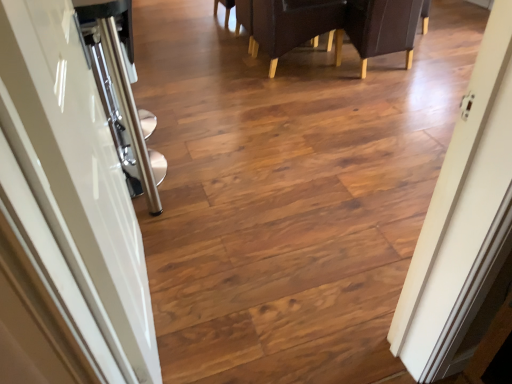
Question: From the image's perspective, is dark brown leather armchair at upper right, the second armchair from the left, above leather-like dark brown chair at upper center?

Choices:
 (A) yes
 (B) no

Answer: (B)

Question: Is dark brown leather armchair at upper right, positioned as the first armchair in right-to-left order, in contact with leather-like dark brown chair at upper center?

Choices:
 (A) no
 (B) yes

Answer: (A)

Question: Is dark brown leather armchair at upper right, the second armchair from the left, shorter than leather-like dark brown chair at upper center?

Choices:
 (A) yes
 (B) no

Answer: (B)

Question: Is leather-like dark brown chair at upper center inside dark brown leather armchair at upper right, the second armchair from the left?

Choices:
 (A) yes
 (B) no

Answer: (B)

Question: Can you confirm if dark brown leather armchair at upper right, positioned as the first armchair in right-to-left order, is bigger than leather-like dark brown chair at upper center?

Choices:
 (A) no
 (B) yes

Answer: (A)

Question: Can you confirm if dark brown leather armchair at upper right, the second armchair from the left, is wider than leather-like dark brown chair at upper center?

Choices:
 (A) no
 (B) yes

Answer: (A)

Question: Can you confirm if glossy white door at left is thinner than dark brown leather armchair at upper center, acting as the first armchair starting from the left?

Choices:
 (A) no
 (B) yes

Answer: (B)

Question: Can you confirm if glossy white door at left is positioned to the left of dark brown leather armchair at upper center, arranged as the 2th armchair when viewed from the right?

Choices:
 (A) yes
 (B) no

Answer: (A)

Question: Is glossy white door at left wider than dark brown leather armchair at upper center, arranged as the 2th armchair when viewed from the right?

Choices:
 (A) no
 (B) yes

Answer: (A)

Question: Does glossy white door at left have a lesser height compared to dark brown leather armchair at upper center, arranged as the 2th armchair when viewed from the right?

Choices:
 (A) no
 (B) yes

Answer: (A)

Question: From the image's perspective, is glossy white door at left over dark brown leather armchair at upper center, arranged as the 2th armchair when viewed from the right?

Choices:
 (A) no
 (B) yes

Answer: (A)

Question: Is glossy white door at left aimed at dark brown leather armchair at upper center, acting as the first armchair starting from the left?

Choices:
 (A) no
 (B) yes

Answer: (A)

Question: Is glossy white door at left smaller than leather-like dark brown chair at upper center?

Choices:
 (A) yes
 (B) no

Answer: (A)